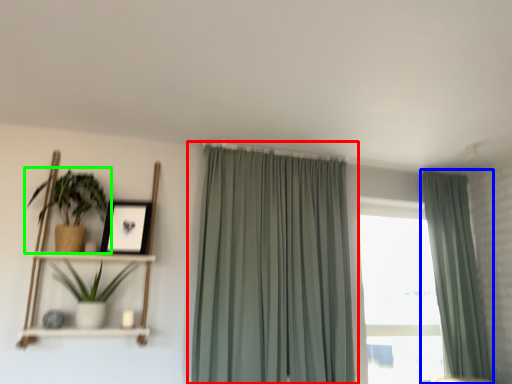
Question: Which object is the farthest from curtain (highlighted by a red box)? Choose among these: curtain (highlighted by a blue box) or houseplant (highlighted by a green box).

Choices:
 (A) curtain
 (B) houseplant

Answer: (A)